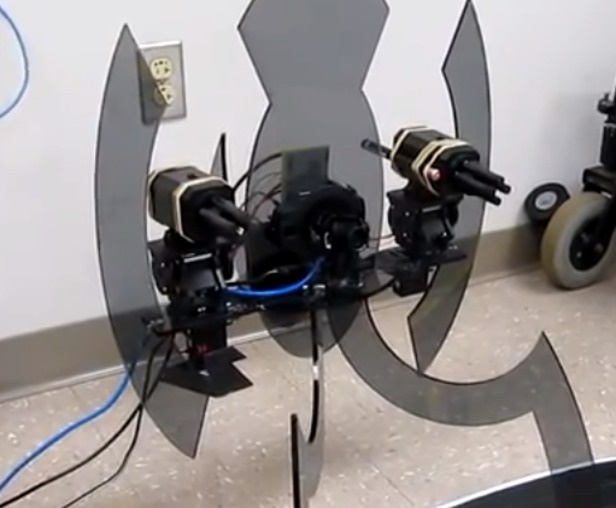
Identify the location of tiled floor. (246, 421).